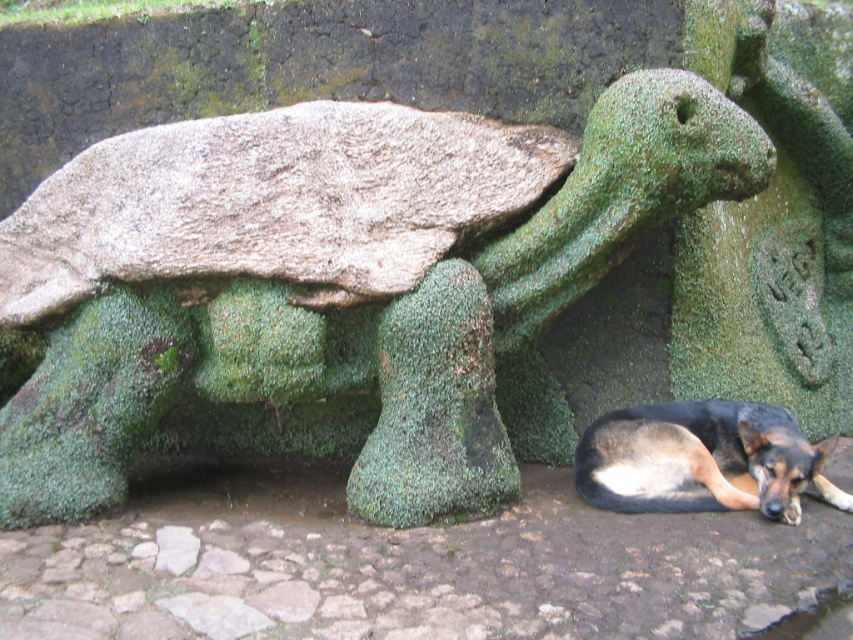
Between green mossy turtle at center and black and tan fur dog at lower right, which one appears on the left side from the viewer's perspective?

green mossy turtle at center is more to the left.

Is green mossy turtle at center shorter than black and tan fur dog at lower right?

No, green mossy turtle at center is not shorter than black and tan fur dog at lower right.

Measure the distance between green mossy turtle at center and camera.

green mossy turtle at center is 2.93 meters away from camera.

At what (x,y) coordinates should I click in order to perform the action: click on green mossy turtle at center. Please return your answer as a coordinate pair (x, y). This screenshot has height=640, width=853. Looking at the image, I should click on pyautogui.click(x=337, y=291).